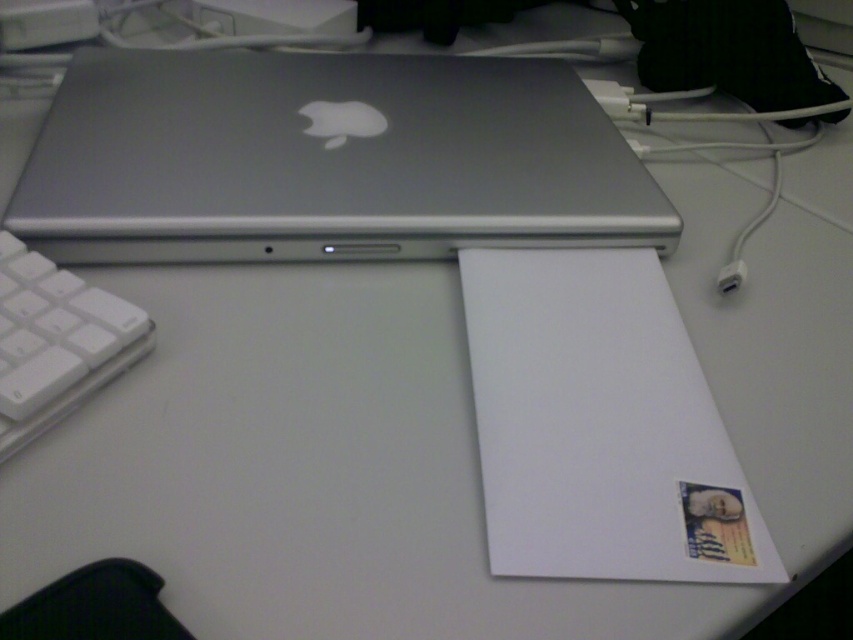
You are organizing your desk and want to place a wireless mouse between the satin silver laptop at upper center and the white plastic keyboard at lower left. What is the minimum distance the mouse needs to cover to fit between them?

The minimum distance the mouse needs to cover is 10.37 inches to fit between the satin silver laptop at upper center and the white plastic keyboard at lower left.

You need to place both the satin silver laptop at upper center and the white plastic plug at lower right into a box that can only fit items up to the size of the laptop. Will both items fit?

The satin silver laptop at upper center is larger than the white plastic plug at lower right. Since the box can only fit items up to the size of the laptop, both items will fit as the plug is smaller.

You are setting up a new desk and want to place a large monitor between the satin silver laptop at upper center and the white plastic keyboard at lower left. Given their sizes, will the monitor fit comfortably between them?

The satin silver laptop at upper center is larger than the white plastic keyboard at lower left, so placing a large monitor between them may not leave enough space for comfortable use. The laptop takes up more space, potentially limiting the available area for the monitor.